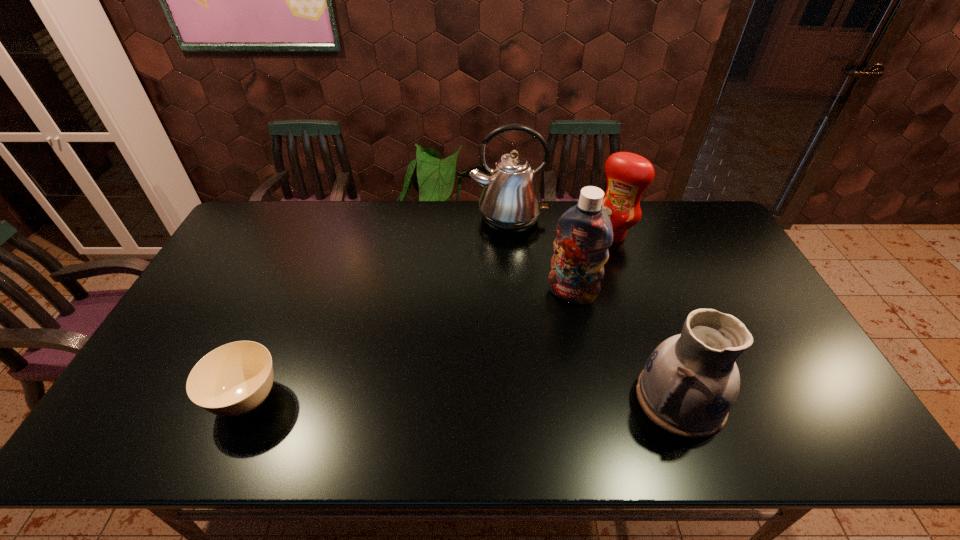
Identify the location of unoccupied area between the condiment and the pottery. The image size is (960, 540). (647, 317).

Where is `vacant area that lies between the kettle and the pottery`? This screenshot has width=960, height=540. vacant area that lies between the kettle and the pottery is located at coordinates (594, 308).

You are a GUI agent. You are given a task and a screenshot of the screen. Output one action in this format:
    pyautogui.click(x=<x>, y=<y>)
    Task: Click on the free space between the shortest object and the pottery
    This screenshot has width=960, height=540.
    Given the screenshot: What is the action you would take?
    pyautogui.click(x=464, y=399)

Select which object appears as the closest to the sugar bowl. Please provide its 2D coordinates. Your answer should be formatted as a tuple, i.e. [(x, y)], where the tuple contains the x and y coordinates of a point satisfying the conditions above.

[(510, 202)]

Identify the location of object identified as the closest to the shampoo. Image resolution: width=960 pixels, height=540 pixels. (628, 175).

Where is `free space that satisfies the following two spatial constraints: 1. on the back side of the shortest object; 2. on the left side of the pottery`? This screenshot has width=960, height=540. free space that satisfies the following two spatial constraints: 1. on the back side of the shortest object; 2. on the left side of the pottery is located at coordinates (248, 399).